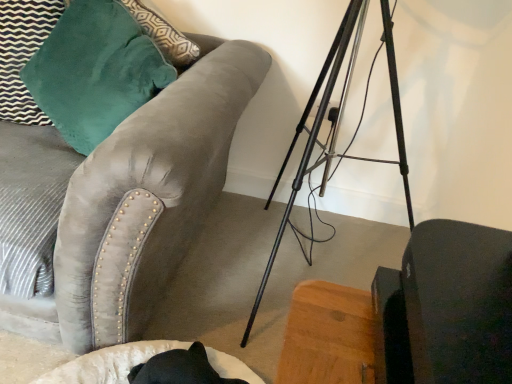
Question: Is matte black swivel chair at lower right facing away from velvet gray couch at upper left?

Choices:
 (A) yes
 (B) no

Answer: (B)

Question: Can you confirm if matte black swivel chair at lower right is wider than velvet gray couch at upper left?

Choices:
 (A) yes
 (B) no

Answer: (B)

Question: Could you tell me if matte black swivel chair at lower right is turned towards velvet gray couch at upper left?

Choices:
 (A) yes
 (B) no

Answer: (B)

Question: Is matte black swivel chair at lower right at the left side of velvet gray couch at upper left?

Choices:
 (A) yes
 (B) no

Answer: (B)

Question: Can you confirm if matte black swivel chair at lower right is bigger than velvet gray couch at upper left?

Choices:
 (A) no
 (B) yes

Answer: (A)

Question: Is velvet teal pillow at upper left wider or thinner than matte black swivel chair at lower right?

Choices:
 (A) thin
 (B) wide

Answer: (B)

Question: From a real-world perspective, relative to matte black swivel chair at lower right, is velvet teal pillow at upper left vertically above or below?

Choices:
 (A) above
 (B) below

Answer: (B)

Question: From the image's perspective, is velvet teal pillow at upper left above or below matte black swivel chair at lower right?

Choices:
 (A) below
 (B) above

Answer: (B)

Question: Is velvet teal pillow at upper left situated inside matte black swivel chair at lower right or outside?

Choices:
 (A) inside
 (B) outside

Answer: (B)

Question: Relative to velvet gray couch at upper left, is matte black swivel chair at lower right in front or behind?

Choices:
 (A) front
 (B) behind

Answer: (A)

Question: Considering the positions of point click(454, 337) and point click(37, 309), is point click(454, 337) closer or farther from the camera than point click(37, 309)?

Choices:
 (A) farther
 (B) closer

Answer: (B)

Question: In terms of size, does matte black swivel chair at lower right appear bigger or smaller than velvet gray couch at upper left?

Choices:
 (A) small
 (B) big

Answer: (A)

Question: Is matte black swivel chair at lower right spatially inside velvet gray couch at upper left, or outside of it?

Choices:
 (A) inside
 (B) outside

Answer: (B)

Question: Is matte black swivel chair at lower right taller or shorter than velvet teal pillow at upper left?

Choices:
 (A) short
 (B) tall

Answer: (A)

Question: Is matte black swivel chair at lower right bigger or smaller than velvet teal pillow at upper left?

Choices:
 (A) big
 (B) small

Answer: (B)